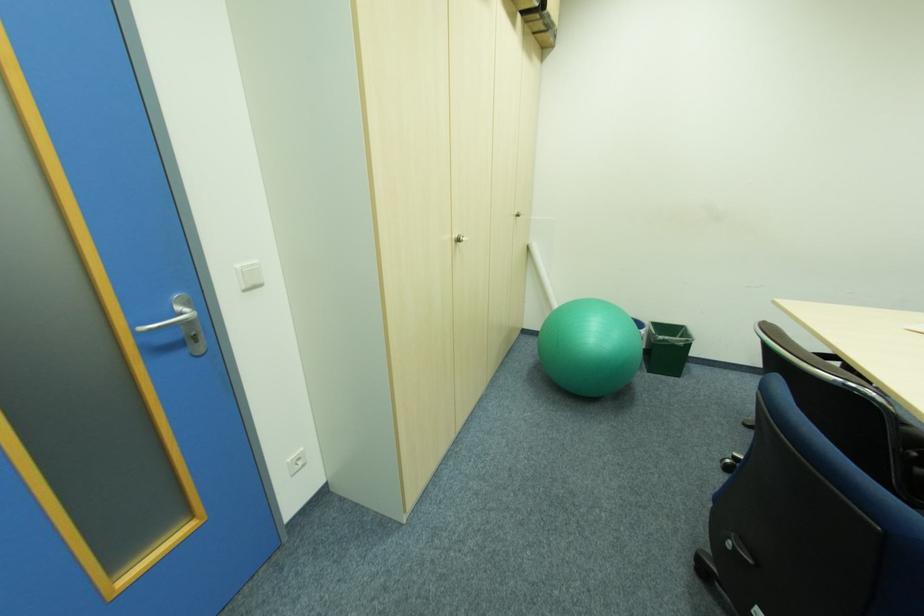
Find where to pull the silver cabinet knob. Please return your answer as a coordinate pair (x, y).

(459, 238)